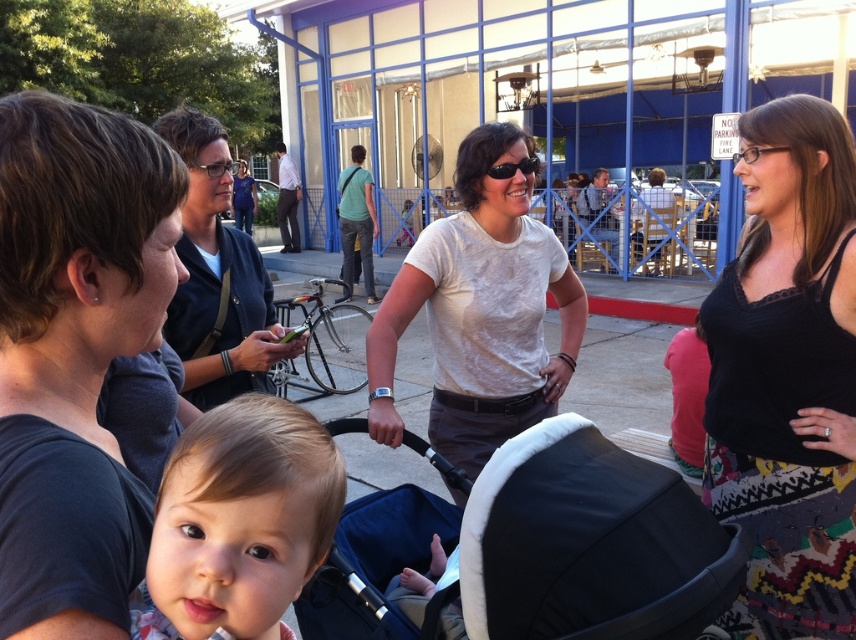
Is white cotton shirt at center shorter than matte black shirt at upper right?

Yes.

Between white cotton shirt at center and matte black shirt at upper right, which one appears on the left side from the viewer's perspective?

white cotton shirt at center

Looking at this image, who is more distant from viewer, [447,410] or [615,253]?

The point [615,253] is behind.

The image size is (856, 640). I want to click on white cotton shirt at center, so click(x=480, y=310).

Is point (215, 189) positioned before point (519, 164)?

Yes, point (215, 189) is in front of point (519, 164).

Looking at this image, how much distance is there between matte black shirt at center and black matte sunglasses at center?

They are 1.04 meters apart.

Where is `matte black shirt at center`? This screenshot has width=856, height=640. matte black shirt at center is located at coordinates (217, 276).

Does green cotton shirt at center appear on the left side of matte black shirt at upper right?

Yes, green cotton shirt at center is to the left of matte black shirt at upper right.

What do you see at coordinates (355, 220) in the screenshot? The height and width of the screenshot is (640, 856). I see `green cotton shirt at center` at bounding box center [355, 220].

Is point (361, 216) positioned after point (604, 180)?

No, (361, 216) is closer to viewer.

Where is `green cotton shirt at center`? This screenshot has height=640, width=856. green cotton shirt at center is located at coordinates (355, 220).